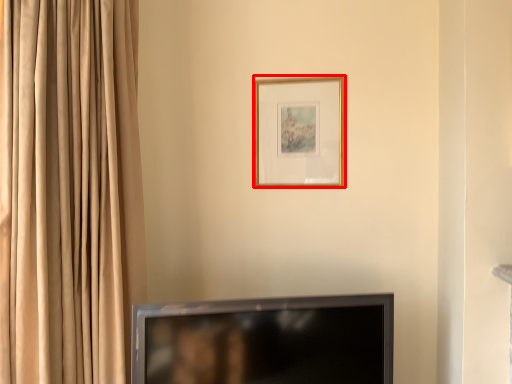
Question: From the image's perspective, what is the correct spatial positioning of picture frame (annotated by the red box) in reference to television?

Choices:
 (A) above
 (B) below

Answer: (A)